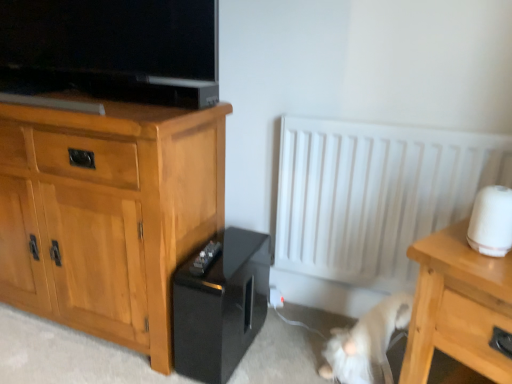
What are the coordinates of `unoccupied region to the right of black glossy amplifier at lower center` in the screenshot? It's located at (282, 347).